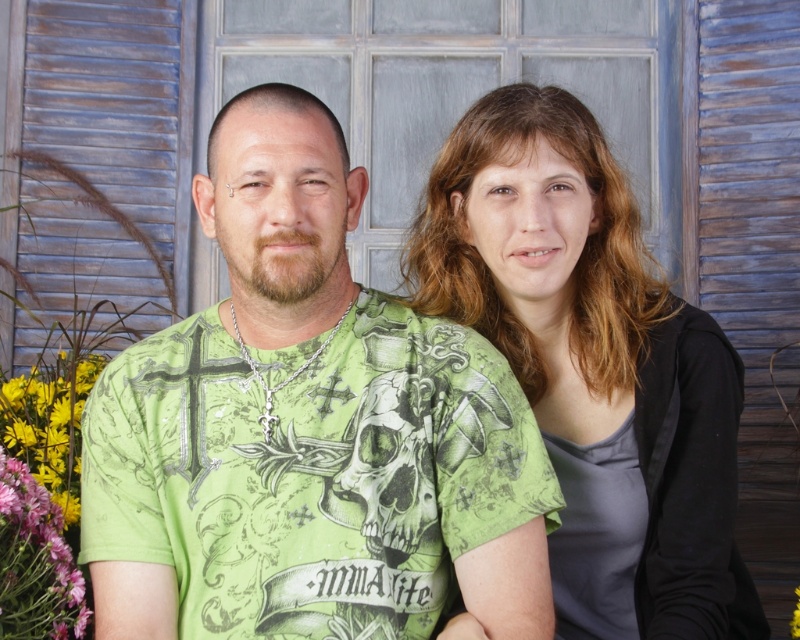
You are a photographer setting up a shoot in front of a rustic wooden door. You notice the matte green shirt at center and the pink fabric at lower left. Based on their positions, which object is higher in the image?

The matte green shirt at center is located above the pink fabric at lower left, so the matte green shirt at center is higher in the image.